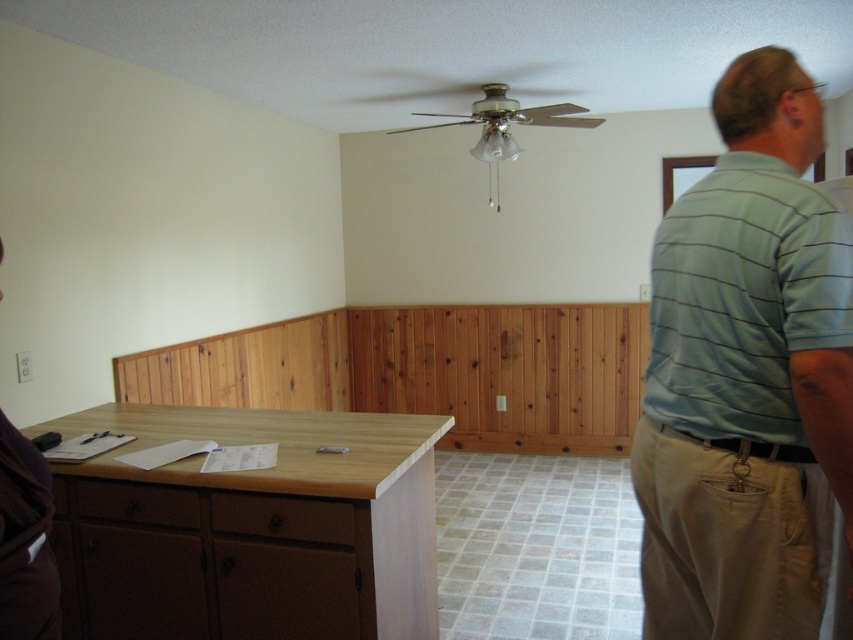
Question: Does light blue striped shirt at upper right come in front of white matte outlet at left?

Choices:
 (A) yes
 (B) no

Answer: (B)

Question: Observing the image, what is the correct spatial positioning of light blue striped shirt at upper right in reference to white matte outlet at left?

Choices:
 (A) below
 (B) above

Answer: (B)

Question: Can you confirm if light blue striped shirt at upper right is positioned to the left of white matte outlet at left?

Choices:
 (A) yes
 (B) no

Answer: (B)

Question: Which point is closer to the camera?

Choices:
 (A) (699, 364)
 (B) (51, 579)

Answer: (B)

Question: Which point appears closest to the camera in this image?

Choices:
 (A) (701, 628)
 (B) (0, 545)

Answer: (B)

Question: Which point appears closest to the camera in this image?

Choices:
 (A) (32, 541)
 (B) (666, 342)

Answer: (A)